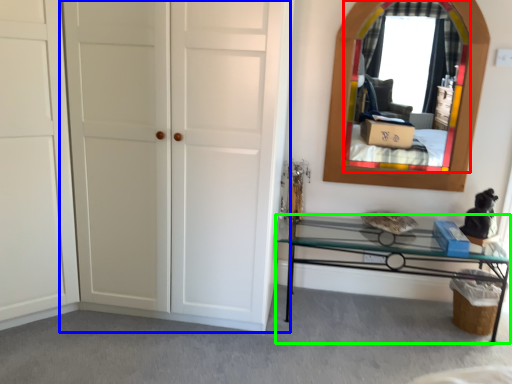
Question: Estimate the real-world distances between objects in this image. Which object is closer to mirror (highlighted by a red box), door (highlighted by a blue box) or table (highlighted by a green box)?

Choices:
 (A) door
 (B) table

Answer: (B)